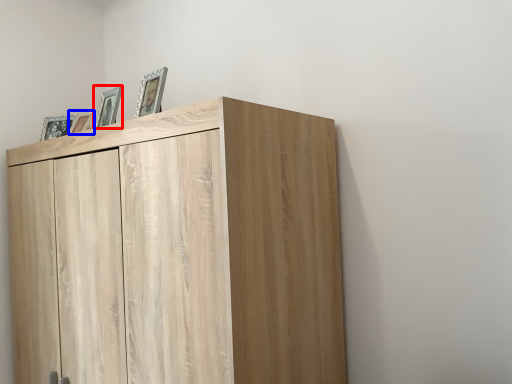
Question: Which object is closer to the camera taking this photo, picture frame (highlighted by a red box) or picture frame (highlighted by a blue box)?

Choices:
 (A) picture frame
 (B) picture frame

Answer: (A)